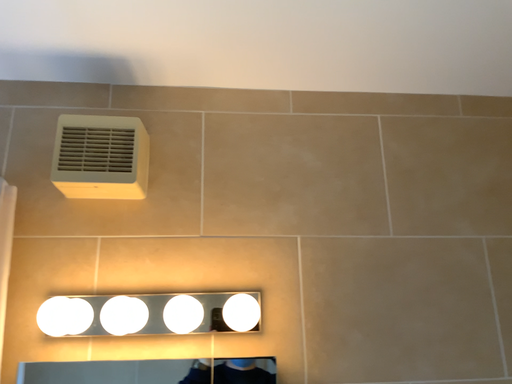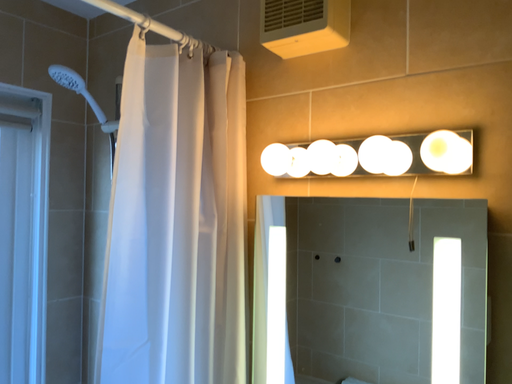
Question: Which way did the camera rotate in the video?

Choices:
 (A) rotated left
 (B) rotated right

Answer: (A)